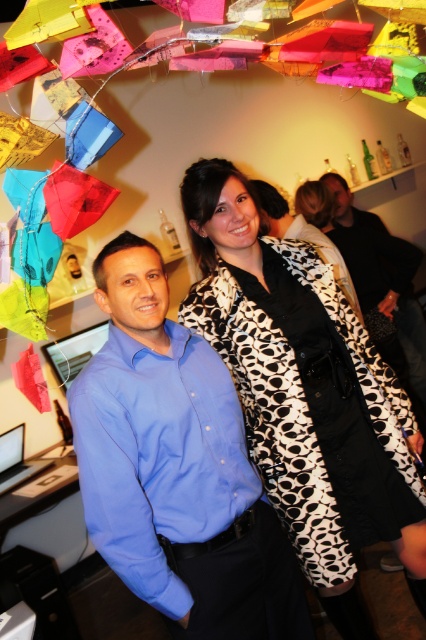
Is point (402, 301) closer to viewer compared to point (299, 228)?

No, it is behind (299, 228).

Does dark brown leather jacket at upper right appear on the right side of blue shirt at center?

Yes, dark brown leather jacket at upper right is to the right of blue shirt at center.

Is point (344, 196) positioned before point (313, 241)?

No.

Where is `dark brown leather jacket at upper right`? The width and height of the screenshot is (426, 640). dark brown leather jacket at upper right is located at coordinates (412, 337).

Does black and white dotted coat at center have a larger size compared to dark brown leather jacket at upper right?

Indeed, black and white dotted coat at center has a larger size compared to dark brown leather jacket at upper right.

Can you confirm if black and white dotted coat at center is positioned below dark brown leather jacket at upper right?

Yes.

Locate an element on the screen. The image size is (426, 640). black and white dotted coat at center is located at coordinates (305, 394).

Consider the image. Between black and white dotted coat at center and blue smooth shirt at center, which one is positioned higher?

Positioned higher is black and white dotted coat at center.

Between black and white dotted coat at center and blue smooth shirt at center, which one appears on the right side from the viewer's perspective?

From the viewer's perspective, black and white dotted coat at center appears more on the right side.

Is point (204, 240) positioned in front of point (146, 358)?

No, (204, 240) is behind (146, 358).

This screenshot has width=426, height=640. I want to click on black and white dotted coat at center, so click(x=305, y=394).